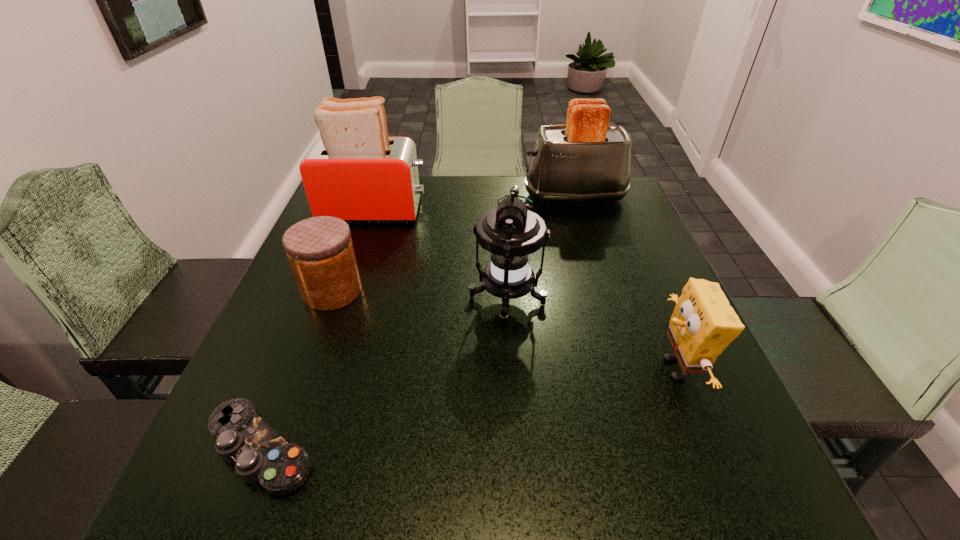
Where is `the second closest object to the left toaster`? the second closest object to the left toaster is located at coordinates (510, 233).

Identify which object is the fourth nearest to the shortest object. Please provide its 2D coordinates. Your answer should be formatted as a tuple, i.e. [(x, y)], where the tuple contains the x and y coordinates of a point satisfying the conditions above.

[(703, 324)]

The image size is (960, 540). In order to click on blank area in the image that satisfies the following two spatial constraints: 1. on the side of the right toaster with the control lever; 2. on the front side of the shortest object in this screenshot , I will do `click(653, 448)`.

At what (x,y) coordinates should I click in order to perform the action: click on vacant region that satisfies the following two spatial constraints: 1. on the front-facing side of the left toaster; 2. on the back side of the lantern. Please return your answer as a coordinate pair (x, y). Looking at the image, I should click on (344, 301).

You are a GUI agent. You are given a task and a screenshot of the screen. Output one action in this format:
    pyautogui.click(x=<x>, y=<y>)
    Task: Click on the free space that satisfies the following two spatial constraints: 1. on the side of the right toaster with the control lever; 2. on the front side of the jar
    Image resolution: width=960 pixels, height=540 pixels.
    Given the screenshot: What is the action you would take?
    pyautogui.click(x=604, y=291)

The image size is (960, 540). Find the location of `free spot that satisfies the following two spatial constraints: 1. on the front-facing side of the left toaster; 2. on the right side of the lantern`. free spot that satisfies the following two spatial constraints: 1. on the front-facing side of the left toaster; 2. on the right side of the lantern is located at coordinates (344, 301).